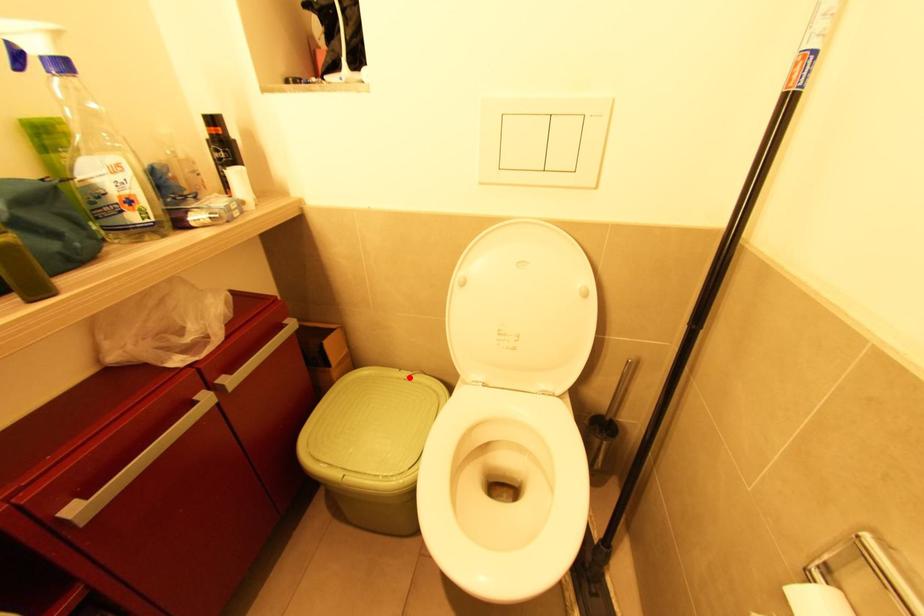
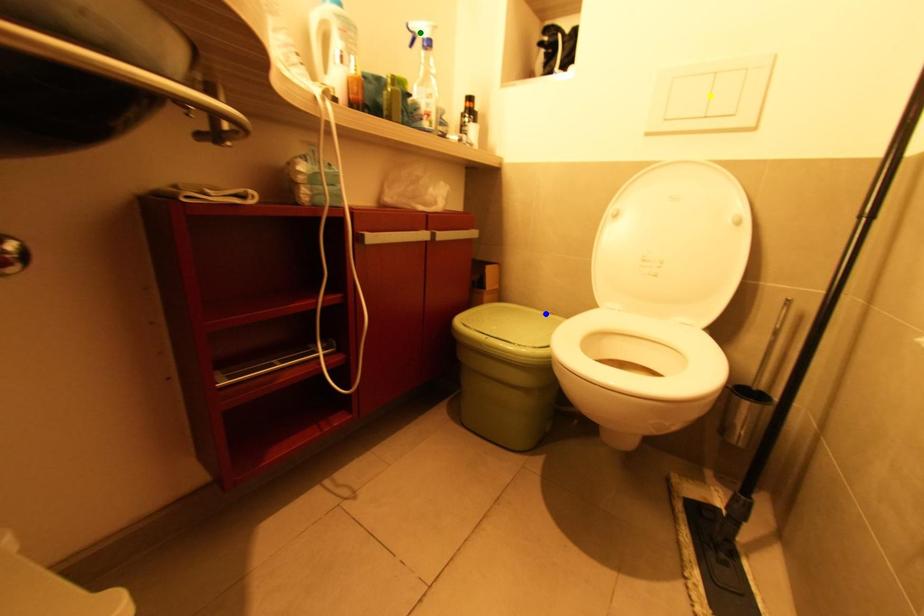
Question: I am providing you with two images of the same scene from different viewpoints. A red point is marked on the first image. You are given multiple points on the second image. Which point in image 2 represents the same 3d spot as the red point in image 1?

Choices:
 (A) yellow point
 (B) green point
 (C) blue point

Answer: (C)